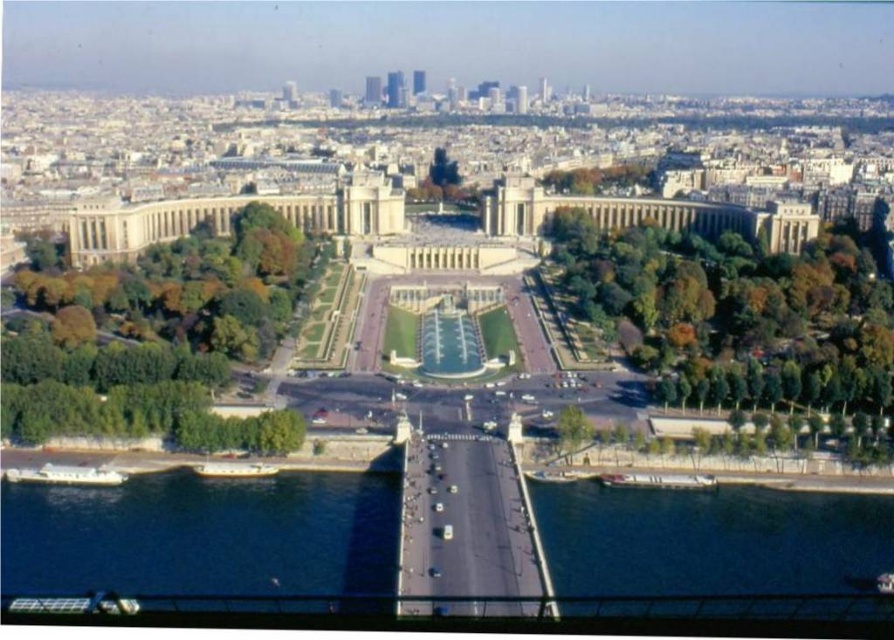
You are standing at the point marked as point (1,586) in this urban landscape. You want to take a photo of the large symmetrical building complex with classical architecture that is the central focus of the image. Will you be able to capture the entire building complex in your photo without moving from your current position?

The point (1,586) is 114.48 meters away from the viewer. Since the building complex is the central focus and the distance is significant, it is likely that the entire building complex can be captured in the photo from that position without needing to move.